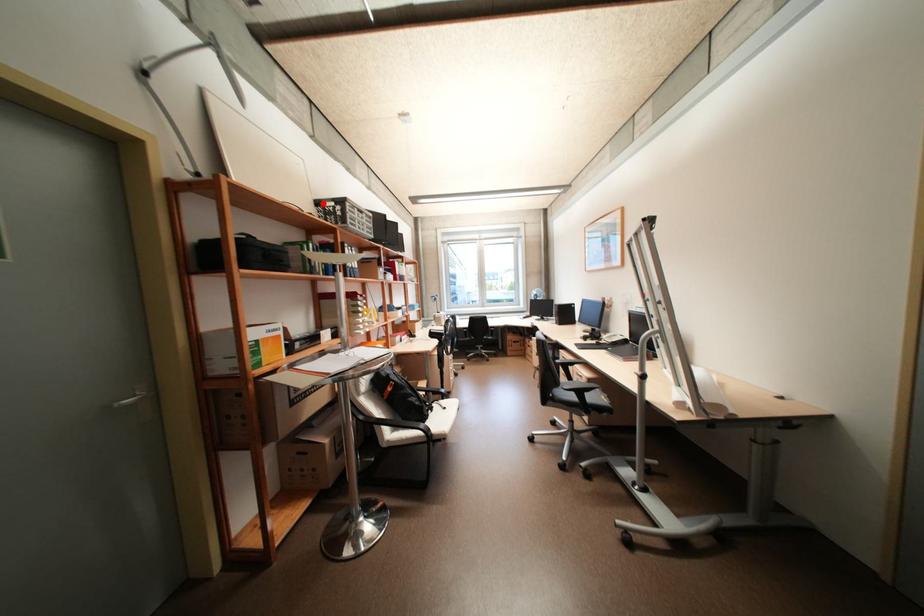
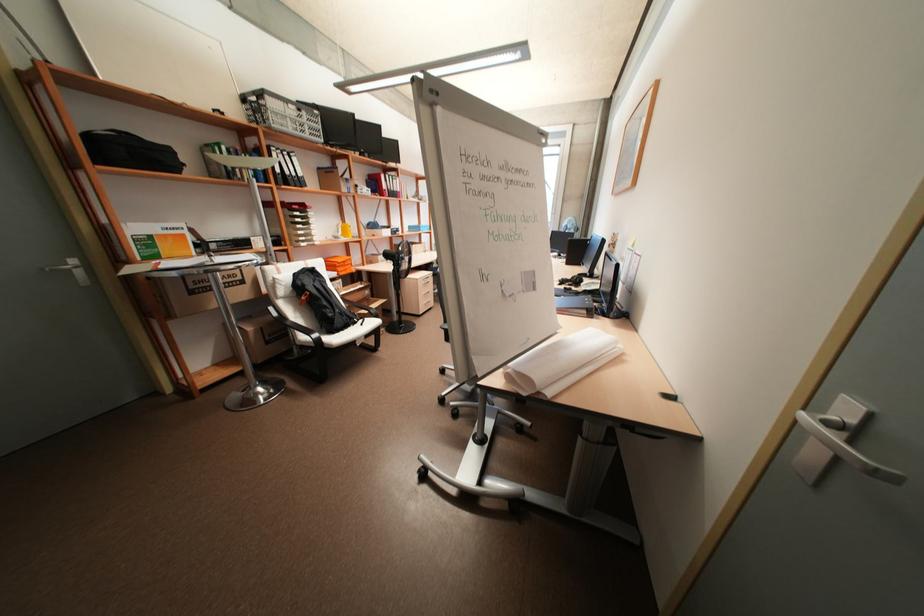
In the second image, find the point that corresponds to the highlighted location in the first image.

(249, 99)